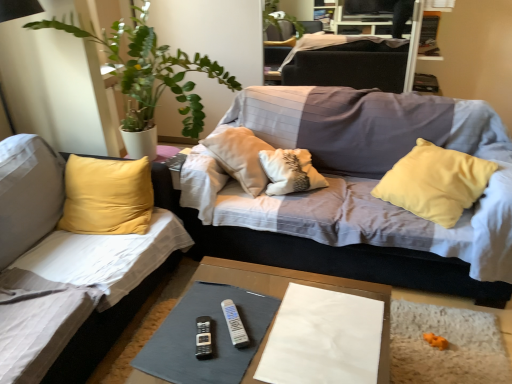
Where is `vacant space underneath white paper at center (from a real-world perspective)`? Image resolution: width=512 pixels, height=384 pixels. vacant space underneath white paper at center (from a real-world perspective) is located at coordinates (325, 337).